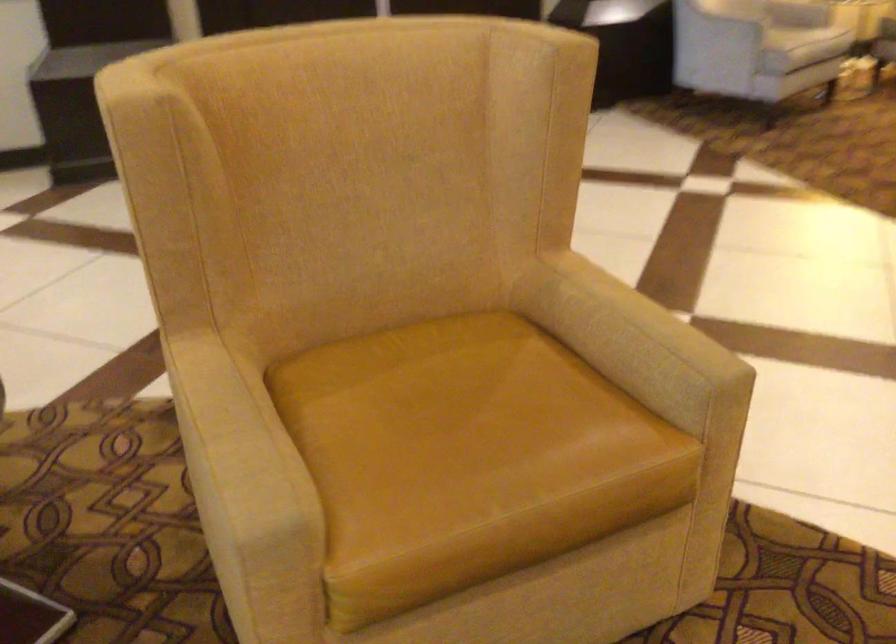
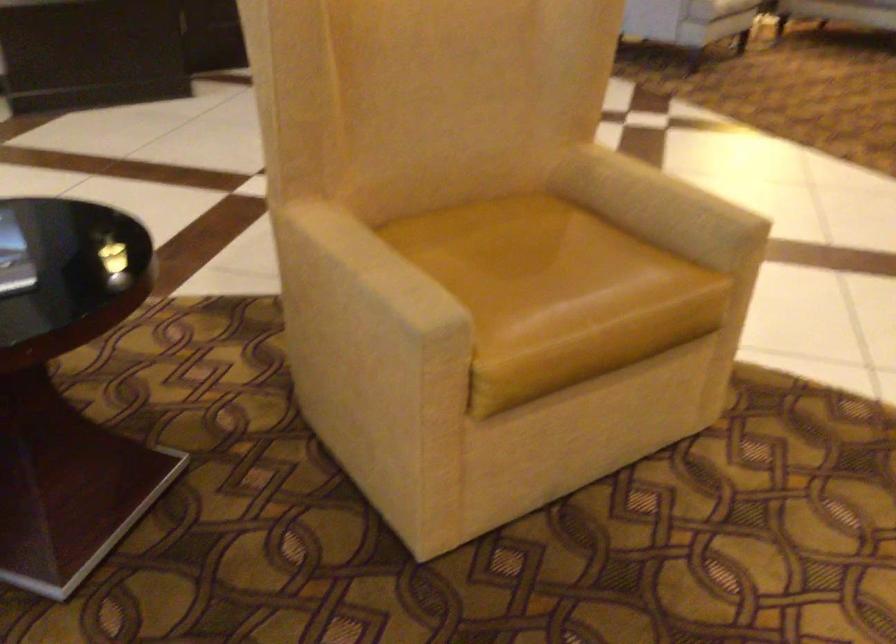
The point at (236, 433) is marked in the first image. Where is the corresponding point in the second image?

(375, 266)